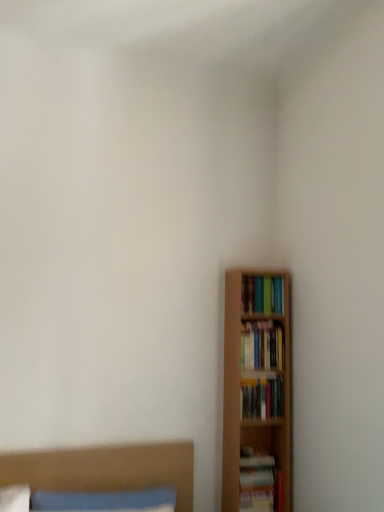
Measure the distance between wooden bed at lower left and camera.

wooden bed at lower left is 2.00 meters from camera.

Where is `wooden bed at lower left`? Image resolution: width=384 pixels, height=512 pixels. wooden bed at lower left is located at coordinates (106, 469).

Identify the location of hardcover books at right, acting as the second book starting from the bottom. (262, 398).

Locate an element on the screen. This screenshot has width=384, height=512. hardcover books at right, which is the 2th book in top-to-bottom order is located at coordinates (262, 346).

What do you see at coordinates (262, 346) in the screenshot?
I see `hardcover books at right, placed as the third book when sorted from bottom to top` at bounding box center [262, 346].

Locate an element on the screen. hardcover book at lower right, the 4th book from the top is located at coordinates (260, 482).

Is matte green book at right, placed as the 1th book when sorted from top to bottom, spatially inside wooden bed at lower left, or outside of it?

matte green book at right, placed as the 1th book when sorted from top to bottom, cannot be found inside wooden bed at lower left.

Looking at this image, which is more to the left, matte green book at right, placed as the 1th book when sorted from top to bottom, or wooden bed at lower left?

Positioned to the left is wooden bed at lower left.

Is matte green book at right, placed as the 1th book when sorted from top to bottom, oriented away from wooden bed at lower left?

No, wooden bed at lower left is not at the back of matte green book at right, placed as the 1th book when sorted from top to bottom.

Is matte green book at right, the fourth book when ordered from bottom to top, wider than wooden bed at lower left?

Incorrect, the width of matte green book at right, the fourth book when ordered from bottom to top, does not surpass that of wooden bed at lower left.

How much distance is there between hardcover books at right, acting as the second book starting from the bottom, and matte green book at right, placed as the 1th book when sorted from top to bottom?

hardcover books at right, acting as the second book starting from the bottom, and matte green book at right, placed as the 1th book when sorted from top to bottom, are 17.88 inches apart.

Does hardcover books at right, acting as the second book starting from the bottom, have a greater height compared to matte green book at right, placed as the 1th book when sorted from top to bottom?

Incorrect, the height of hardcover books at right, acting as the second book starting from the bottom, is not larger of that of matte green book at right, placed as the 1th book when sorted from top to bottom.

From a real-world perspective, between hardcover books at right, which ranks as the 3th book in top-to-bottom order, and matte green book at right, placed as the 1th book when sorted from top to bottom, who is vertically higher?

From a 3D spatial view, matte green book at right, placed as the 1th book when sorted from top to bottom, is above.

Between point (252, 406) and point (268, 311), which one is positioned in front?

The point (252, 406) is closer to the camera.

Is point (252, 279) positioned before point (275, 499)?

No, (252, 279) is behind (275, 499).

Which of these two, matte green book at right, placed as the 1th book when sorted from top to bottom, or hardcover book at lower right, arranged as the first book when ordered from the bottom, is smaller?

With smaller size is matte green book at right, placed as the 1th book when sorted from top to bottom.

Based on the photo, is matte green book at right, placed as the 1th book when sorted from top to bottom, outside of hardcover book at lower right, the 4th book from the top?

matte green book at right, placed as the 1th book when sorted from top to bottom, is positioned outside hardcover book at lower right, the 4th book from the top.

How distant is matte green book at right, placed as the 1th book when sorted from top to bottom, from hardcover book at lower right, the 4th book from the top?

matte green book at right, placed as the 1th book when sorted from top to bottom, and hardcover book at lower right, the 4th book from the top, are 88.54 centimeters apart from each other.

Considering the positions of point (242, 415) and point (178, 511), is point (242, 415) closer or farther from the camera than point (178, 511)?

Clearly, point (242, 415) is more distant from the camera than point (178, 511).

Locate an element on the screen. bed that is under the hardcover books at right, acting as the second book starting from the bottom (from a real-world perspective) is located at coordinates (106, 469).

Considering their positions, is hardcover books at right, which ranks as the 3th book in top-to-bottom order, located in front of or behind wooden bed at lower left?

In the image, hardcover books at right, which ranks as the 3th book in top-to-bottom order, appears behind wooden bed at lower left.

From the image's perspective, relative to wooden bed at lower left, is hardcover books at right, acting as the second book starting from the bottom, above or below?

Clearly, from the image's perspective, hardcover books at right, acting as the second book starting from the bottom, is above wooden bed at lower left.

From a real-world perspective, relative to hardcover books at right, which ranks as the 3th book in top-to-bottom order, is wooden bed at lower left vertically above or below?

In terms of real-world spatial position, wooden bed at lower left is below hardcover books at right, which ranks as the 3th book in top-to-bottom order.

Based on the photo, does wooden bed at lower left have a larger size compared to hardcover books at right, which ranks as the 3th book in top-to-bottom order?

Correct, wooden bed at lower left is larger in size than hardcover books at right, which ranks as the 3th book in top-to-bottom order.

Is hardcover books at right, which ranks as the 3th book in top-to-bottom order, located within wooden bed at lower left?

No, wooden bed at lower left does not contain hardcover books at right, which ranks as the 3th book in top-to-bottom order.

How distant is wooden bed at lower left from hardcover books at right, which ranks as the 3th book in top-to-bottom order?

The distance of wooden bed at lower left from hardcover books at right, which ranks as the 3th book in top-to-bottom order, is 24.46 inches.

From the image's perspective, which is above, matte green book at right, placed as the 1th book when sorted from top to bottom, or hardcover books at right, acting as the second book starting from the bottom?

matte green book at right, placed as the 1th book when sorted from top to bottom, is shown above in the image.

Which is more to the right, matte green book at right, placed as the 1th book when sorted from top to bottom, or hardcover books at right, acting as the second book starting from the bottom?

matte green book at right, placed as the 1th book when sorted from top to bottom.

Is matte green book at right, the fourth book when ordered from bottom to top, thinner than hardcover books at right, acting as the second book starting from the bottom?

No, matte green book at right, the fourth book when ordered from bottom to top, is not thinner than hardcover books at right, acting as the second book starting from the bottom.

Which of these two, matte green book at right, the fourth book when ordered from bottom to top, or hardcover books at right, which ranks as the 3th book in top-to-bottom order, stands taller?

matte green book at right, the fourth book when ordered from bottom to top, is taller.

Considering the sizes of hardcover book at lower right, the 4th book from the top, and matte green book at right, placed as the 1th book when sorted from top to bottom, in the image, is hardcover book at lower right, the 4th book from the top, taller or shorter than matte green book at right, placed as the 1th book when sorted from top to bottom,?

In the image, hardcover book at lower right, the 4th book from the top, appears to be taller than matte green book at right, placed as the 1th book when sorted from top to bottom.

Considering the sizes of objects hardcover book at lower right, the 4th book from the top, and matte green book at right, the fourth book when ordered from bottom to top, in the image provided, who is bigger, hardcover book at lower right, the 4th book from the top, or matte green book at right, the fourth book when ordered from bottom to top,?

With larger size is hardcover book at lower right, the 4th book from the top.

Would you say hardcover book at lower right, arranged as the first book when ordered from the bottom, is to the left or to the right of matte green book at right, placed as the 1th book when sorted from top to bottom, in the picture?

Based on their positions, hardcover book at lower right, arranged as the first book when ordered from the bottom, is located to the left of matte green book at right, placed as the 1th book when sorted from top to bottom.

Is hardcover book at lower right, the 4th book from the top, directly adjacent to matte green book at right, placed as the 1th book when sorted from top to bottom?

There is a gap between hardcover book at lower right, the 4th book from the top, and matte green book at right, placed as the 1th book when sorted from top to bottom.

The image size is (384, 512). Identify the location of the 4th book counting from the right side of the wooden bed at lower left. (262, 294).

From the image's perspective, starting from the hardcover books at right, acting as the second book starting from the bottom, which book is the 2nd one above? Please provide its 2D coordinates.

[(262, 294)]

Considering their positions, is hardcover books at right, placed as the third book when sorted from bottom to top, positioned closer to hardcover books at right, which ranks as the 3th book in top-to-bottom order, than hardcover book at lower right, the 4th book from the top?

hardcover books at right, placed as the third book when sorted from bottom to top, lies closer to hardcover books at right, which ranks as the 3th book in top-to-bottom order, than the other object.

Based on their spatial positions, is hardcover books at right, acting as the second book starting from the bottom, or hardcover books at right, placed as the third book when sorted from bottom to top, closer to matte green book at right, the fourth book when ordered from bottom to top?

hardcover books at right, placed as the third book when sorted from bottom to top, lies closer to matte green book at right, the fourth book when ordered from bottom to top, than the other object.

From the image, which object appears to be nearer to hardcover book at lower right, the 4th book from the top, hardcover books at right, acting as the second book starting from the bottom, or matte green book at right, placed as the 1th book when sorted from top to bottom?

Based on the image, hardcover books at right, acting as the second book starting from the bottom, appears to be nearer to hardcover book at lower right, the 4th book from the top.

When comparing their distances from hardcover books at right, acting as the second book starting from the bottom, does matte green book at right, the fourth book when ordered from bottom to top, or hardcover book at lower right, the 4th book from the top, seem further?

Based on the image, matte green book at right, the fourth book when ordered from bottom to top, appears to be further to hardcover books at right, acting as the second book starting from the bottom.

Looking at the image, which one is located closer to hardcover book at lower right, arranged as the first book when ordered from the bottom, hardcover books at right, which ranks as the 3th book in top-to-bottom order, or hardcover books at right, placed as the third book when sorted from bottom to top?

The object closer to hardcover book at lower right, arranged as the first book when ordered from the bottom, is hardcover books at right, which ranks as the 3th book in top-to-bottom order.

Considering their positions, is wooden bed at lower left positioned further to hardcover book at lower right, the 4th book from the top, than hardcover books at right, placed as the third book when sorted from bottom to top?

hardcover books at right, placed as the third book when sorted from bottom to top, is further to hardcover book at lower right, the 4th book from the top.

Based on the photo, considering their positions, is wooden bed at lower left positioned closer to hardcover books at right, which ranks as the 3th book in top-to-bottom order, than hardcover books at right, which is the 2th book in top-to-bottom order?

hardcover books at right, which is the 2th book in top-to-bottom order, is positioned closer to the anchor hardcover books at right, which ranks as the 3th book in top-to-bottom order.

Estimate the real-world distances between objects in this image. Which object is further from matte green book at right, placed as the 1th book when sorted from top to bottom, hardcover books at right, placed as the third book when sorted from bottom to top, or wooden bed at lower left?

Based on the image, wooden bed at lower left appears to be further to matte green book at right, placed as the 1th book when sorted from top to bottom.

Identify the location of book between hardcover books at right, which is the 2th book in top-to-bottom order, and hardcover book at lower right, arranged as the first book when ordered from the bottom, in the vertical direction. The height and width of the screenshot is (512, 384). (262, 398).

This screenshot has width=384, height=512. In order to click on book that lies between matte green book at right, the fourth book when ordered from bottom to top, and hardcover books at right, acting as the second book starting from the bottom, from top to bottom in this screenshot , I will do `click(262, 346)`.

Identify the location of bed between matte green book at right, the fourth book when ordered from bottom to top, and hardcover book at lower right, the 4th book from the top, in the vertical direction. (106, 469).

At what (x,y) coordinates should I click in order to perform the action: click on book between wooden bed at lower left and hardcover books at right, which ranks as the 3th book in top-to-bottom order, from front to back. Please return your answer as a coordinate pair (x, y). Image resolution: width=384 pixels, height=512 pixels. Looking at the image, I should click on (260, 482).